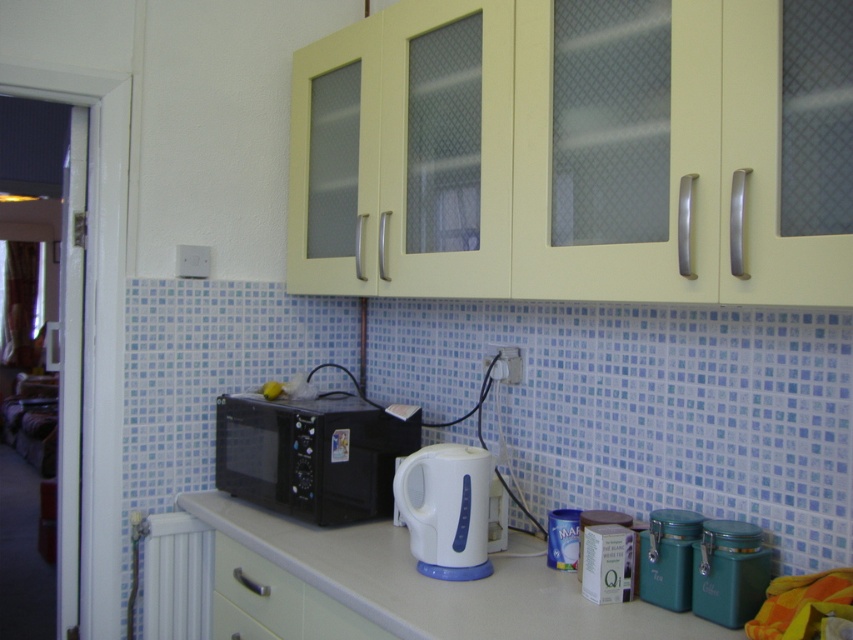
You are organizing items on the kitchen counter and want to place a new spice jar between the white plastic kettle at center and the white plastic radiator at lower left. Based on their positions, where should you place the spice jar?

The white plastic kettle at center is above the white plastic radiator at lower left, so you should place the spice jar between them in the vertical space between the kettle and radiator.

You are a chef preparing to place a new spice jar on the white glossy counter at center. However, you notice the white plastic kettle at center is in the way. Can you place the spice jar on the counter without moving the kettle?

The white glossy counter at center is not as tall as the white plastic kettle at center, so the counter is shorter. This means the spice jar cannot be placed on the counter without the kettle obstructing it due to the height difference.

You are standing in the kitchen and need to place a new item exactly at point (482,547). The item requires a space that is at least 5 feet away from the camera. Can you confirm if the point is far enough?

The distance of point (482,547) from camera is 5.23 feet, which is just enough to accommodate the item requiring at least 5 feet distance.